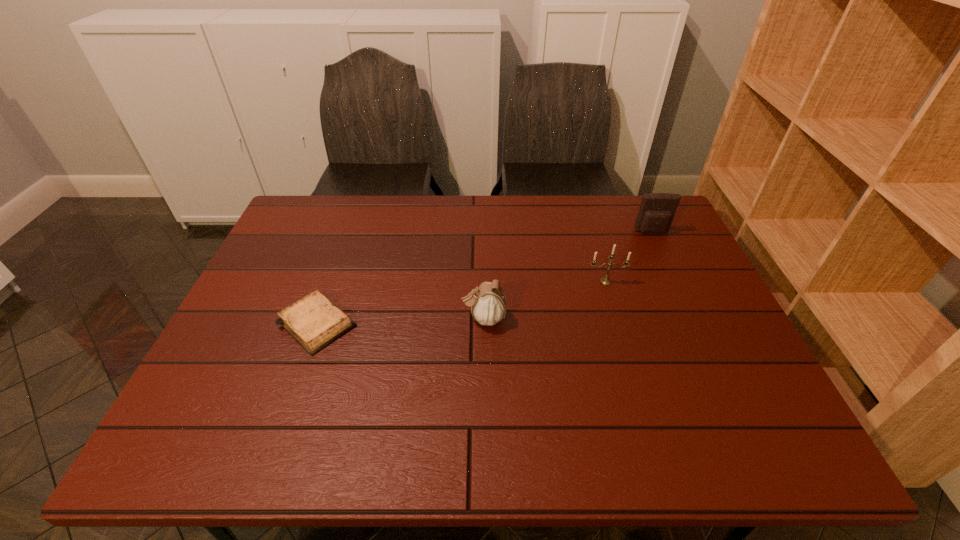
The image size is (960, 540). What are the coordinates of `free space between the diary and the rightmost object` in the screenshot? It's located at (485, 278).

Locate an element on the screen. The height and width of the screenshot is (540, 960). free area in between the right pouch and the third object from right to left is located at coordinates (567, 275).

The image size is (960, 540). I want to click on object that is the closest to the leftmost object, so click(488, 303).

This screenshot has height=540, width=960. Identify the location of object that can be found as the third closest to the farther pouch. (314, 321).

What are the coordinates of `free location that satisfies the following two spatial constraints: 1. on the back side of the shortest object; 2. on the left side of the second object from right to left` in the screenshot? It's located at (331, 281).

I want to click on free space that satisfies the following two spatial constraints: 1. on the front side of the candle; 2. on the front-facing side of the second object from left to right, so click(x=616, y=319).

Locate an element on the screen. Image resolution: width=960 pixels, height=540 pixels. free location that satisfies the following two spatial constraints: 1. on the front-facing side of the left pouch; 2. on the front side of the shortest object is located at coordinates (484, 323).